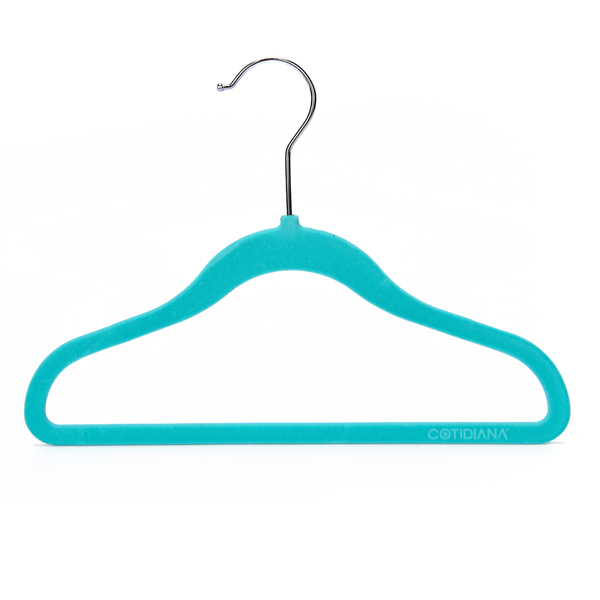
Identify the location of far right point of hanger. (564, 398).